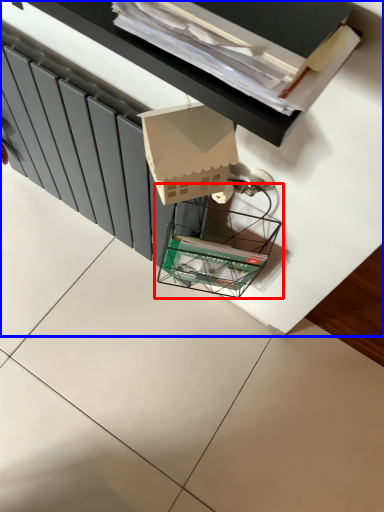
Question: Which of the following is the farthest to the observer, glass box (highlighted by a red box) or furniture (highlighted by a blue box)?

Choices:
 (A) glass box
 (B) furniture

Answer: (A)